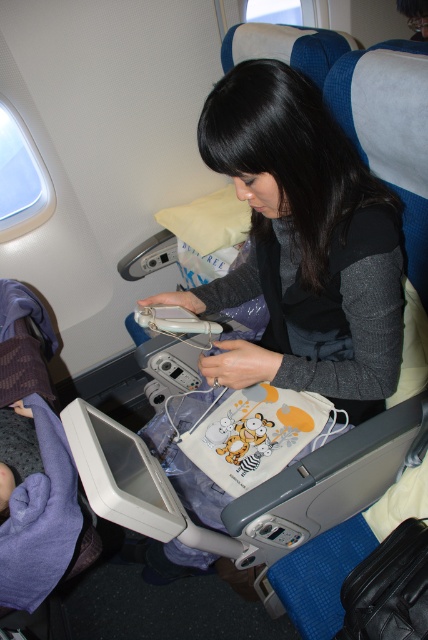
You are a flight attendant checking the cabin. You notice a passenger seated in the window seat holding a small white bag with cartoon animals on it. The bag is on her lap. You need to hand her a safety pamphlet. The pamphlet is currently at point with coordinates point (300,241). Can you reach the pamphlet from your current position?

The point (300,241) is 38.59 inches away from the viewer. Since the flight attendant can typically reach about 36 inches, the pamphlet is slightly out of reach. You may need to move closer to retrieve it.

You are a flight attendant checking seat pockets for passengers. You notice the matte gray sweater at center and the purple soft blanket at lower left. Which item is larger in size?

The matte gray sweater at center is bigger than the purple soft blanket at lower left.